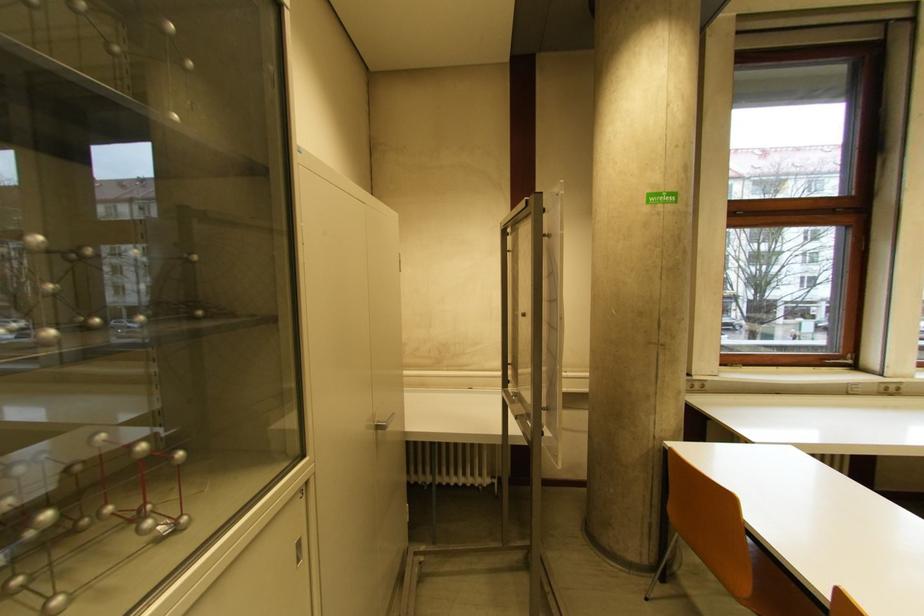
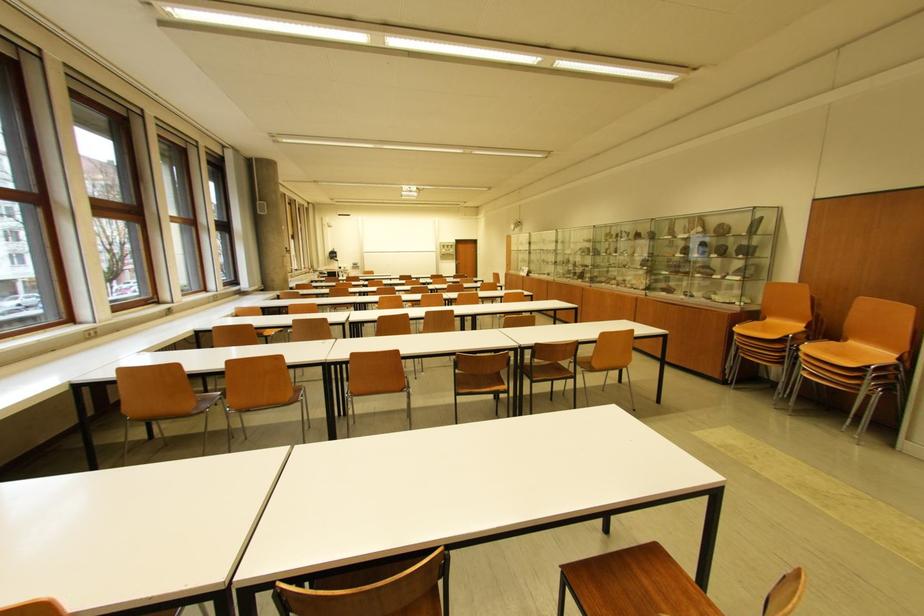
Question: Based on the continuous images, in which direction is the camera rotating? Reply with the corresponding letter.

Choices:
 (A) Left
 (B) Right
 (C) Up
 (D) Down

Answer: (B)